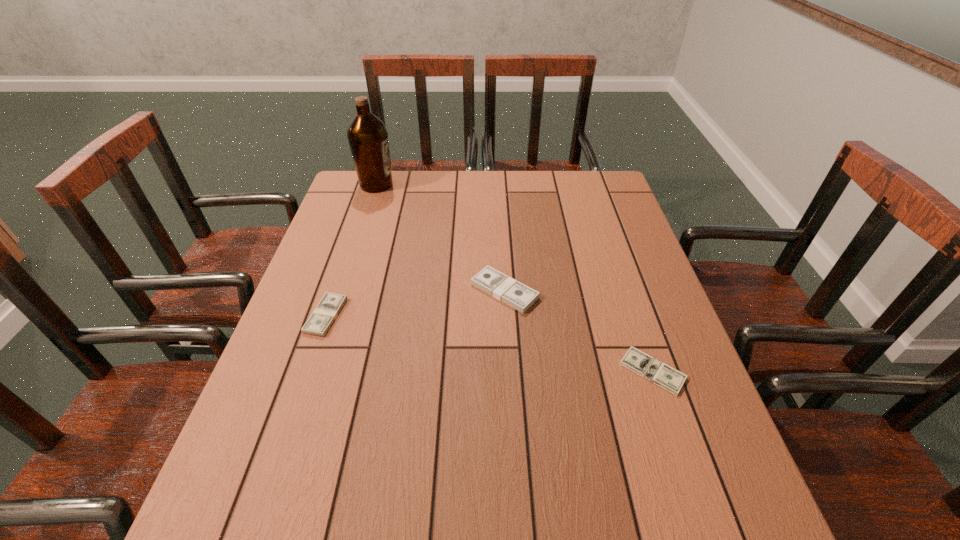
Find the location of a particular element. Image resolution: width=960 pixels, height=540 pixels. vacant area between the second shortest dollar and the second tallest object is located at coordinates (415, 303).

Find the location of a particular element. This screenshot has height=540, width=960. free spot between the farthest object and the second shortest object is located at coordinates (351, 250).

You are a GUI agent. You are given a task and a screenshot of the screen. Output one action in this format:
    pyautogui.click(x=<x>, y=<y>)
    Task: Click on the empty location between the olive oil and the shortest dollar
    Image resolution: width=960 pixels, height=540 pixels.
    Given the screenshot: What is the action you would take?
    pyautogui.click(x=515, y=278)

Point out which object is positioned as the third nearest to the tallest object. Please provide its 2D coordinates. Your answer should be formatted as a tuple, i.e. [(x, y)], where the tuple contains the x and y coordinates of a point satisfying the conditions above.

[(661, 374)]

What are the coordinates of `object identified as the third closest to the leftmost dollar` in the screenshot? It's located at (661, 374).

Locate an element on the screen. Image resolution: width=960 pixels, height=540 pixels. dollar that is the second closest to the tallest dollar is located at coordinates (330, 305).

Find the location of a particular element. This screenshot has height=540, width=960. the closest dollar relative to the tallest object is located at coordinates (500, 286).

Locate an element on the screen. The height and width of the screenshot is (540, 960). vacant space that satisfies the following two spatial constraints: 1. on the label of the olive oil; 2. on the front side of the second tallest dollar is located at coordinates (334, 316).

What are the coordinates of `vacant area in the image that satisfies the following two spatial constraints: 1. on the label of the third object from left to right; 2. on the left side of the farthest object` in the screenshot? It's located at (342, 291).

Where is `vacant position in the image that satisfies the following two spatial constraints: 1. on the back side of the third tallest object; 2. on the left side of the tallest dollar`? vacant position in the image that satisfies the following two spatial constraints: 1. on the back side of the third tallest object; 2. on the left side of the tallest dollar is located at coordinates (334, 291).